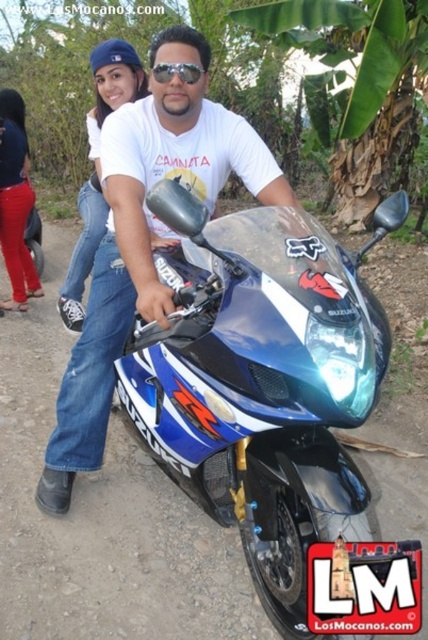
Question: Where is blue glossy sportbike at center located in relation to shiny black sunglasses at center in the image?

Choices:
 (A) below
 (B) above

Answer: (A)

Question: Does matte white t-shirt at center have a larger size compared to shiny black sunglasses at center?

Choices:
 (A) no
 (B) yes

Answer: (B)

Question: Which object is closer to the camera taking this photo?

Choices:
 (A) blue glossy sportbike at center
 (B) matte white t-shirt at center
 (C) matte white t-shirt at upper center

Answer: (A)

Question: Does blue glossy sportbike at center have a larger size compared to matte red pants at lower left?

Choices:
 (A) yes
 (B) no

Answer: (A)

Question: Which object is the closest to the matte red pants at lower left?

Choices:
 (A) blue glossy sportbike at center
 (B) matte white t-shirt at center

Answer: (B)

Question: Which object is the closest to the shiny black sunglasses at center?

Choices:
 (A) blue glossy sportbike at center
 (B) matte red pants at lower left

Answer: (A)